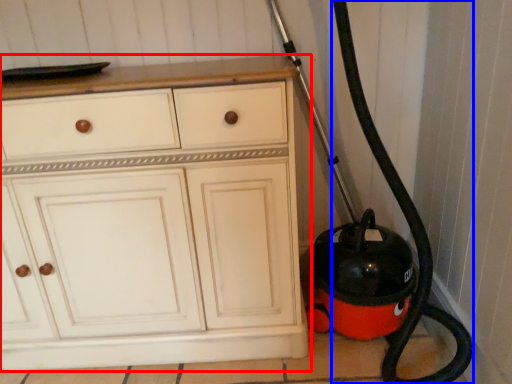
Question: Which point is further to the camera, chest of drawers (highlighted by a red box) or garden hose (highlighted by a blue box)?

Choices:
 (A) chest of drawers
 (B) garden hose

Answer: (A)